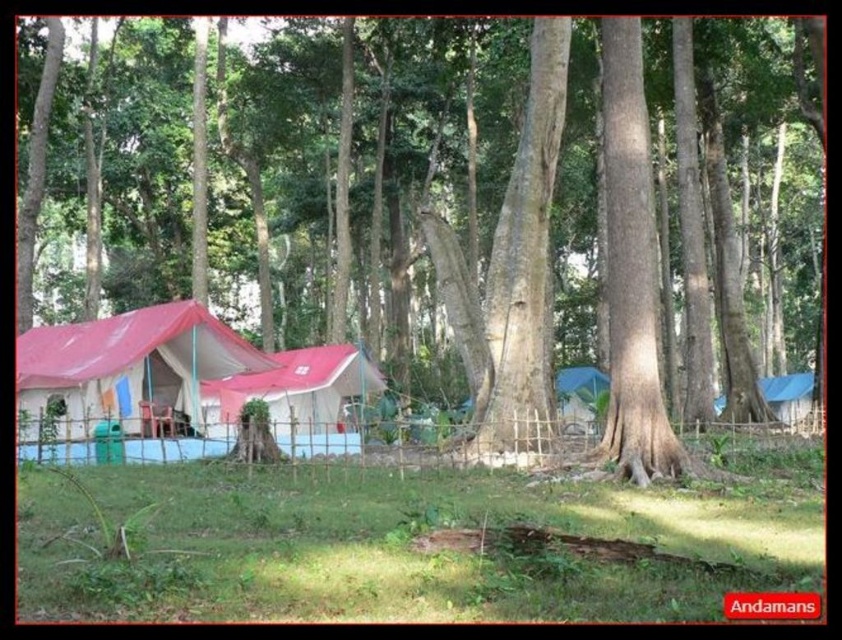
Which is below, smooth bark tree at center or matte red tent at lower left?

Positioned lower is matte red tent at lower left.

Can you confirm if smooth bark tree at center is positioned to the left of matte red tent at lower left?

Incorrect, smooth bark tree at center is not on the left side of matte red tent at lower left.

Image resolution: width=842 pixels, height=640 pixels. I want to click on smooth bark tree at center, so click(x=360, y=157).

At what (x,y) coordinates should I click in order to perform the action: click on smooth bark tree at center. Please return your answer as a coordinate pair (x, y). The width and height of the screenshot is (842, 640). Looking at the image, I should click on (360, 157).

Based on the photo, who is shorter, smooth bark tree at center or matte red tent at center?

With less height is matte red tent at center.

Who is taller, smooth bark tree at center or matte red tent at center?

smooth bark tree at center is taller.

Is point (798, 51) less distant than point (355, 429)?

Yes, it is in front of point (355, 429).

Where is `smooth bark tree at center`? smooth bark tree at center is located at coordinates (360, 157).

Does matte red tent at lower left have a lesser width compared to matte red tent at center?

Yes.

Consider the image. Is the position of matte red tent at lower left more distant than that of matte red tent at center?

That is False.

The image size is (842, 640). What do you see at coordinates (126, 365) in the screenshot? I see `matte red tent at lower left` at bounding box center [126, 365].

Where is `matte red tent at lower left`? matte red tent at lower left is located at coordinates (126, 365).